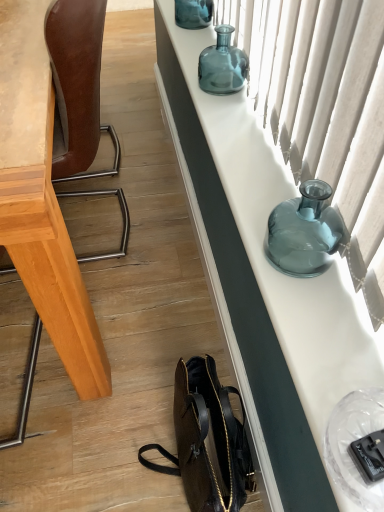
You are a GUI agent. You are given a task and a screenshot of the screen. Output one action in this format:
    pyautogui.click(x=<x>, y=<y>)
    Task: Click on the free point behind translucent glass vase at upper right, the first bottle positioned from the bottom
    
    Given the screenshot: What is the action you would take?
    (269, 193)